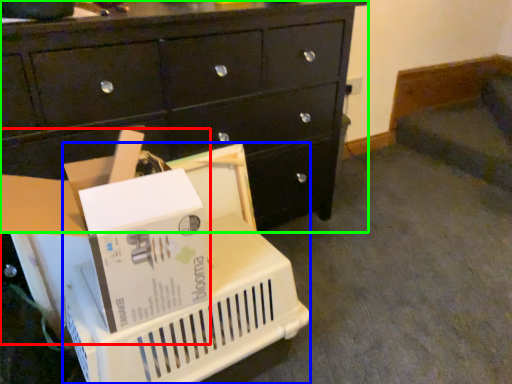
Question: Which object is the closest to the storage box (highlighted by a red box)? Choose among these: basket (highlighted by a blue box) or chest of drawers (highlighted by a green box).

Choices:
 (A) basket
 (B) chest of drawers

Answer: (A)